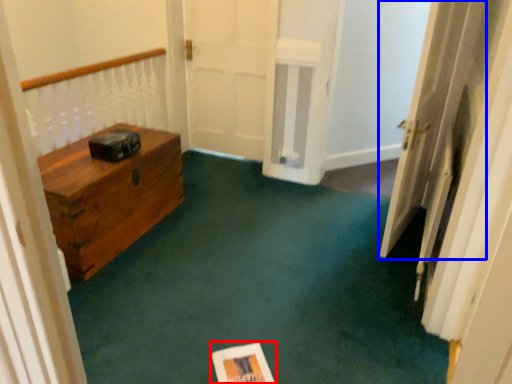
Question: Which object appears farthest to the camera in this image, copy (highlighted by a red box) or door (highlighted by a blue box)?

Choices:
 (A) copy
 (B) door

Answer: (B)